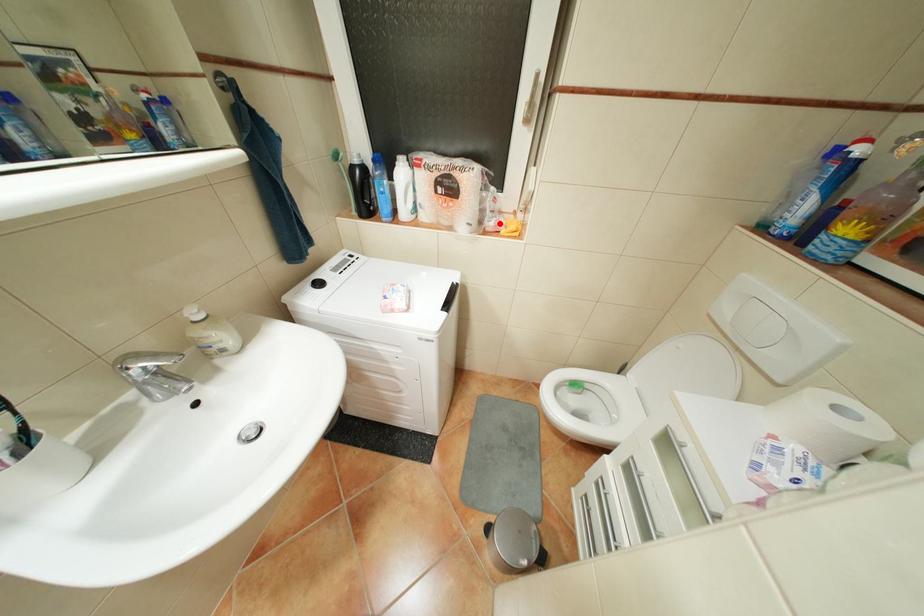
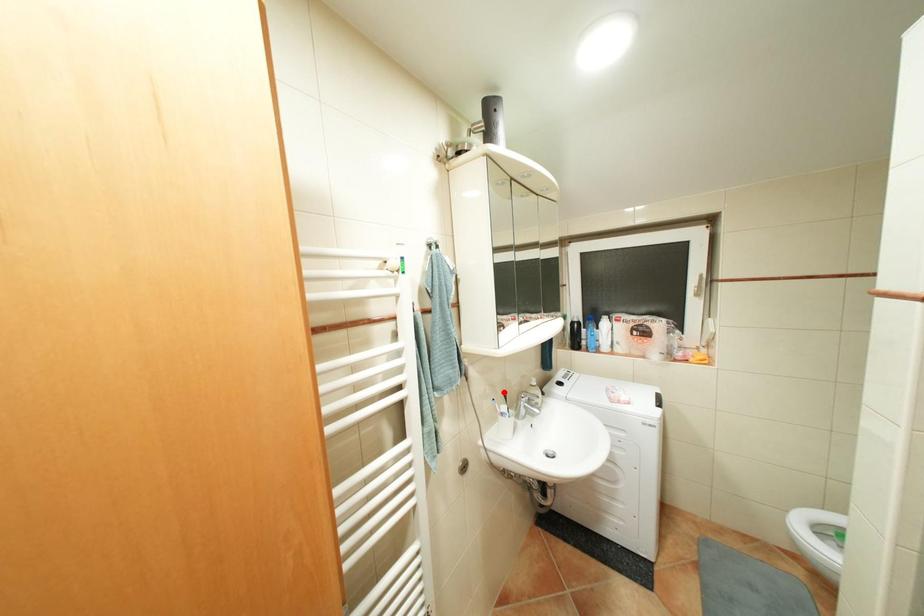
I am providing you with two images of the same scene from different viewpoints. A red point is marked on the first image and another point is marked on the second image. Are the points marked in image1 and image2 representing the same 3D position?

No